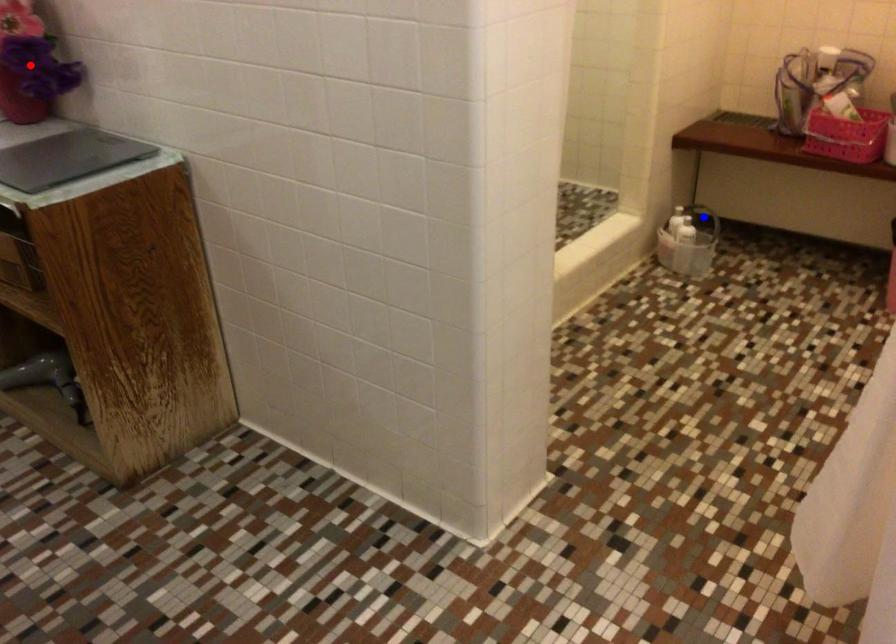
Question: In the image, two points are highlighted. Which point is nearer to the camera? Reply with the corresponding letter.

Choices:
 (A) blue point
 (B) red point

Answer: (B)